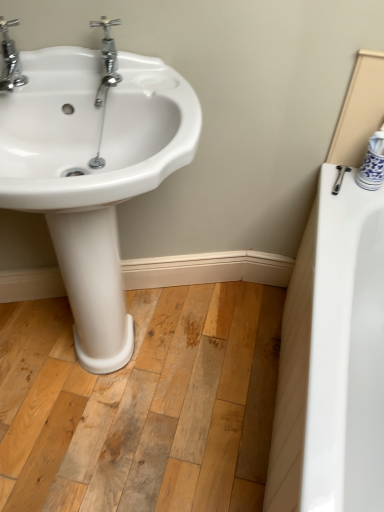
Describe the element at coordinates (10, 59) in the screenshot. I see `chrome metallic faucet at upper left, the 1th tap from the left` at that location.

Locate an element on the screen. The image size is (384, 512). white glossy sink at left is located at coordinates (92, 172).

Identify the location of chrome/metallic faucet at upper left, arranged as the first tap when viewed from the right. This screenshot has height=512, width=384. (107, 57).

Based on their sizes in the image, would you say white glossy sink at left is bigger or smaller than chrome metallic faucet at upper left, the second tap when ordered from right to left?

Considering their sizes, white glossy sink at left takes up more space than chrome metallic faucet at upper left, the second tap when ordered from right to left.

Would you say white glossy sink at left is inside or outside chrome metallic faucet at upper left, the second tap when ordered from right to left?

white glossy sink at left is located beyond the bounds of chrome metallic faucet at upper left, the second tap when ordered from right to left.

Between white glossy sink at left and chrome metallic faucet at upper left, the second tap when ordered from right to left, which one appears on the left side from the viewer's perspective?

chrome metallic faucet at upper left, the second tap when ordered from right to left, is more to the left.

Based on their positions, is chrome/metallic faucet at upper left, arranged as the first tap when viewed from the right, located to the left or right of chrome metallic faucet at upper left, the second tap when ordered from right to left?

In the image, chrome/metallic faucet at upper left, arranged as the first tap when viewed from the right, appears on the right side of chrome metallic faucet at upper left, the second tap when ordered from right to left.

Looking at this image, in the image, is chrome/metallic faucet at upper left, the 2th tap in the left-to-right sequence, positioned in front of or behind chrome metallic faucet at upper left, the 1th tap from the left?

In the image, chrome/metallic faucet at upper left, the 2th tap in the left-to-right sequence, appears behind chrome metallic faucet at upper left, the 1th tap from the left.

How different are the orientations of chrome/metallic faucet at upper left, the 2th tap in the left-to-right sequence, and chrome metallic faucet at upper left, the 1th tap from the left, in degrees?

There is a 1.45-degree angle between the facing directions of chrome/metallic faucet at upper left, the 2th tap in the left-to-right sequence, and chrome metallic faucet at upper left, the 1th tap from the left.

Is point (106, 66) closer to viewer compared to point (14, 72)?

No, it is behind (14, 72).

From a real-world perspective, who is located higher, chrome/metallic faucet at upper left, the 2th tap in the left-to-right sequence, or white glossy sink at left?

chrome/metallic faucet at upper left, the 2th tap in the left-to-right sequence, is physically above.

Does chrome/metallic faucet at upper left, the 2th tap in the left-to-right sequence, have a greater width compared to white glossy sink at left?

No.

The height and width of the screenshot is (512, 384). Find the location of `sink that appears on the left of chrome/metallic faucet at upper left, arranged as the first tap when viewed from the right`. sink that appears on the left of chrome/metallic faucet at upper left, arranged as the first tap when viewed from the right is located at coordinates (92, 172).

Considering the positions of objects chrome/metallic faucet at upper left, the 2th tap in the left-to-right sequence, and white glossy sink at left in the image provided, who is more to the right, chrome/metallic faucet at upper left, the 2th tap in the left-to-right sequence, or white glossy sink at left?

Positioned to the right is chrome/metallic faucet at upper left, the 2th tap in the left-to-right sequence.

Which of these two, chrome metallic faucet at upper left, the second tap when ordered from right to left, or chrome/metallic faucet at upper left, the 2th tap in the left-to-right sequence, is thinner?

With smaller width is chrome/metallic faucet at upper left, the 2th tap in the left-to-right sequence.

You are a GUI agent. You are given a task and a screenshot of the screen. Output one action in this format:
    pyautogui.click(x=<x>, y=<y>)
    Task: Click on the tap that appears above the chrome/metallic faucet at upper left, arranged as the first tap when viewed from the right (from a real-world perspective)
    
    Given the screenshot: What is the action you would take?
    pyautogui.click(x=10, y=59)

Are chrome metallic faucet at upper left, the second tap when ordered from right to left, and chrome/metallic faucet at upper left, the 2th tap in the left-to-right sequence, located far from each other?

No.

From the image's perspective, is chrome metallic faucet at upper left, the second tap when ordered from right to left, on top of chrome/metallic faucet at upper left, arranged as the first tap when viewed from the right?

Actually, chrome metallic faucet at upper left, the second tap when ordered from right to left, appears below chrome/metallic faucet at upper left, arranged as the first tap when viewed from the right, in the image.

From a real-world perspective, which is physically above, white glossy sink at left or chrome/metallic faucet at upper left, arranged as the first tap when viewed from the right?

chrome/metallic faucet at upper left, arranged as the first tap when viewed from the right, is physically above.

Is white glossy sink at left aimed at chrome/metallic faucet at upper left, arranged as the first tap when viewed from the right?

No, white glossy sink at left is not turned towards chrome/metallic faucet at upper left, arranged as the first tap when viewed from the right.

Which object is further away from the camera, white glossy sink at left or chrome/metallic faucet at upper left, arranged as the first tap when viewed from the right?

chrome/metallic faucet at upper left, arranged as the first tap when viewed from the right, is more distant.

Considering the relative sizes of white glossy sink at left and chrome/metallic faucet at upper left, arranged as the first tap when viewed from the right, in the image provided, is white glossy sink at left wider than chrome/metallic faucet at upper left, arranged as the first tap when viewed from the right,?

Yes.

From a real-world perspective, is chrome metallic faucet at upper left, the second tap when ordered from right to left, positioned under white glossy sink at left based on gravity?

Actually, chrome metallic faucet at upper left, the second tap when ordered from right to left, is physically above white glossy sink at left in the real world.

Looking at this image, which object is further away from the camera, chrome metallic faucet at upper left, the 1th tap from the left, or white glossy sink at left?

chrome metallic faucet at upper left, the 1th tap from the left, is further away from the camera.

Is chrome metallic faucet at upper left, the 1th tap from the left, taller or shorter than white glossy sink at left?

Considering their sizes, chrome metallic faucet at upper left, the 1th tap from the left, has less height than white glossy sink at left.

Is point (9, 86) closer or farther from the camera than point (146, 147)?

Point (9, 86).

Locate an element on the screen. The width and height of the screenshot is (384, 512). sink on the right of chrome metallic faucet at upper left, the 1th tap from the left is located at coordinates (92, 172).

The height and width of the screenshot is (512, 384). What are the coordinates of `tap below the chrome metallic faucet at upper left, the second tap when ordered from right to left (from a real-world perspective)` in the screenshot? It's located at (107, 57).

Looking at the image, which one is located closer to white glossy sink at left, chrome/metallic faucet at upper left, the 2th tap in the left-to-right sequence, or chrome metallic faucet at upper left, the 1th tap from the left?

Among the two, chrome/metallic faucet at upper left, the 2th tap in the left-to-right sequence, is located nearer to white glossy sink at left.

Based on their spatial positions, is chrome metallic faucet at upper left, the second tap when ordered from right to left, or white glossy sink at left further from chrome/metallic faucet at upper left, the 2th tap in the left-to-right sequence?

Among the two, white glossy sink at left is located further to chrome/metallic faucet at upper left, the 2th tap in the left-to-right sequence.

Which object lies further to the anchor point chrome metallic faucet at upper left, the second tap when ordered from right to left, chrome/metallic faucet at upper left, arranged as the first tap when viewed from the right, or white glossy sink at left?

white glossy sink at left lies further to chrome metallic faucet at upper left, the second tap when ordered from right to left, than the other object.

Estimate the real-world distances between objects in this image. Which object is further from chrome/metallic faucet at upper left, the 2th tap in the left-to-right sequence, white glossy sink at left or chrome metallic faucet at upper left, the 1th tap from the left?

Among the two, white glossy sink at left is located further to chrome/metallic faucet at upper left, the 2th tap in the left-to-right sequence.

Estimate the real-world distances between objects in this image. Which object is further from chrome metallic faucet at upper left, the 1th tap from the left, white glossy sink at left or chrome/metallic faucet at upper left, the 2th tap in the left-to-right sequence?

white glossy sink at left lies further to chrome metallic faucet at upper left, the 1th tap from the left, than the other object.

Looking at the image, which one is located closer to white glossy sink at left, chrome metallic faucet at upper left, the 1th tap from the left, or chrome/metallic faucet at upper left, the 2th tap in the left-to-right sequence?

Based on the image, chrome/metallic faucet at upper left, the 2th tap in the left-to-right sequence, appears to be nearer to white glossy sink at left.

Find the location of a particular element. tap between chrome/metallic faucet at upper left, the 2th tap in the left-to-right sequence, and white glossy sink at left from top to bottom is located at coordinates (10, 59).